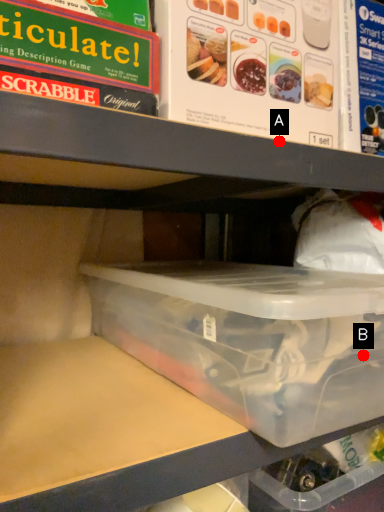
Question: Two points are circled on the image, labeled by A and B beside each circle. Which point is closer to the camera?

Choices:
 (A) A is closer
 (B) B is closer

Answer: (B)